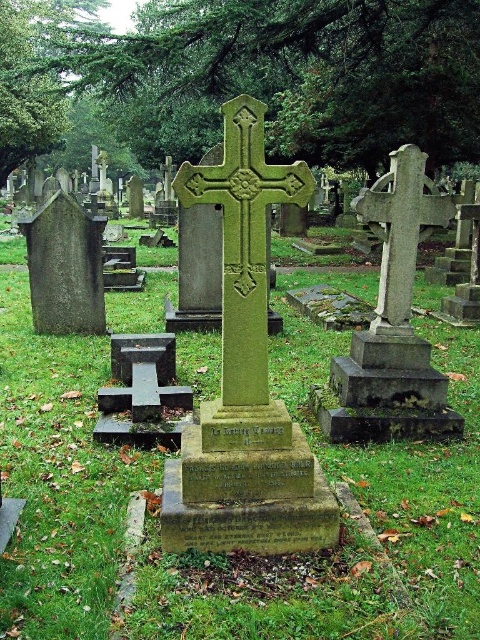
Question: Considering the relative positions of green grass at center and green stone cross at center in the image provided, where is green grass at center located with respect to green stone cross at center?

Choices:
 (A) left
 (B) right

Answer: (A)

Question: Which of the following is the closest to the observer?

Choices:
 (A) green grass at center
 (B) green stone cross at center

Answer: (A)

Question: Does green grass at center have a larger size compared to green stone cross at center?

Choices:
 (A) yes
 (B) no

Answer: (A)

Question: Can you confirm if green grass at center is positioned above green stone cross at center?

Choices:
 (A) no
 (B) yes

Answer: (A)

Question: Which of the following is the closest to the observer?

Choices:
 (A) green grass at center
 (B) green stone cross at center

Answer: (A)